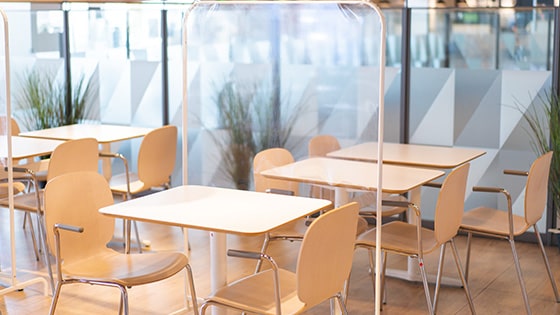
Find the location of a particular element. The height and width of the screenshot is (315, 560). tables is located at coordinates (239, 213), (338, 168), (420, 153), (116, 128), (28, 150).